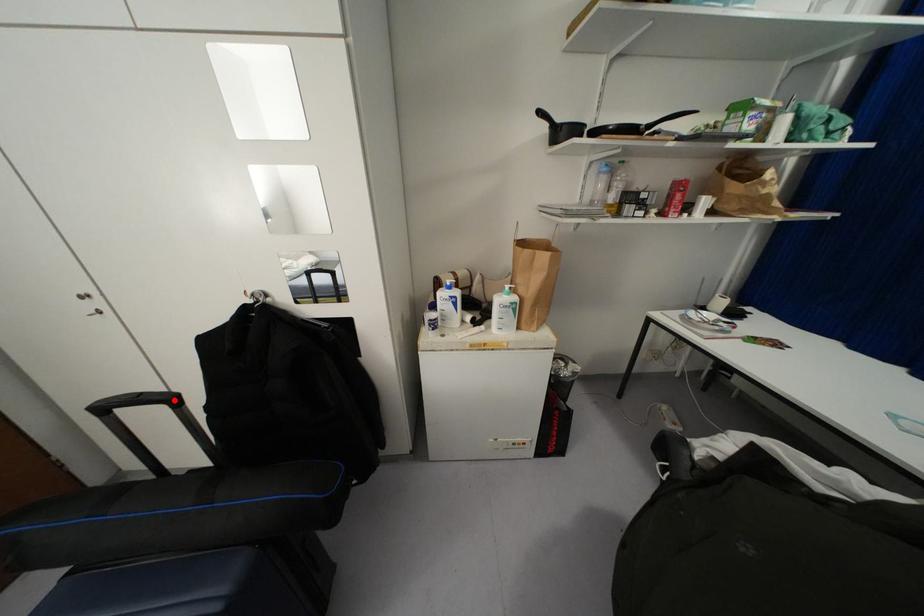
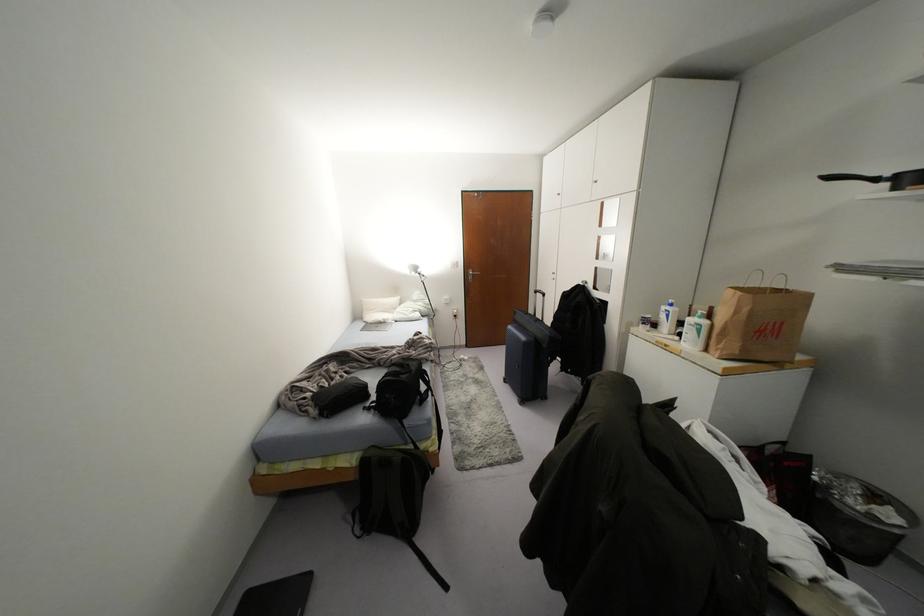
In the second image, find the point that corresponds to the highlighted location in the first image.

(542, 294)